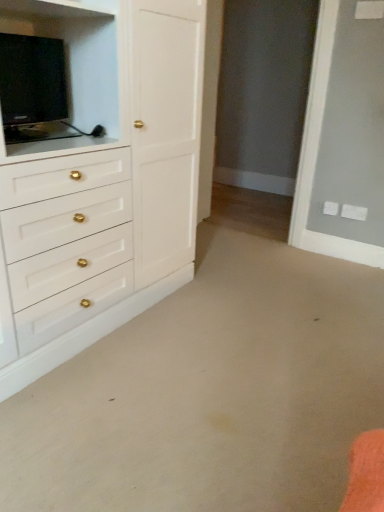
Question: Should I look upward or downward to see white glossy cabinet at left?

Choices:
 (A) up
 (B) down

Answer: (A)